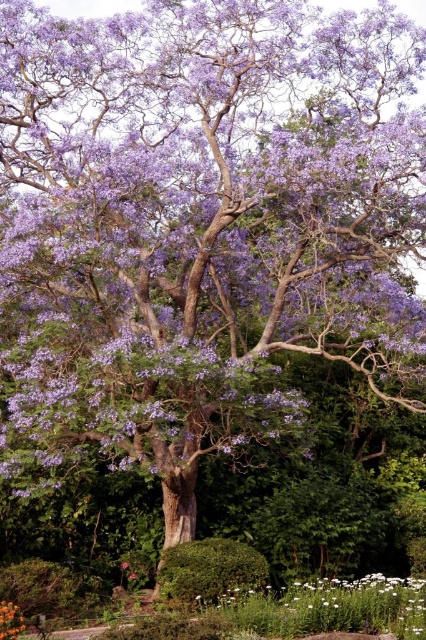
Question: Where is white matte flowers at lower right located in relation to orange matte flower at center in the image?

Choices:
 (A) right
 (B) left

Answer: (A)

Question: Can you confirm if white matte flowers at lower right is wider than orange matte flower at center?

Choices:
 (A) yes
 (B) no

Answer: (A)

Question: Can you confirm if white matte flowers at lower right is positioned above orange matte flower at center?

Choices:
 (A) yes
 (B) no

Answer: (B)

Question: Which point is farther to the camera?

Choices:
 (A) click(x=6, y=636)
 (B) click(x=356, y=616)

Answer: (B)